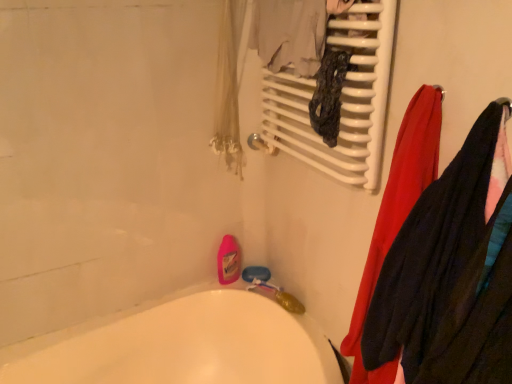
Question: Does white glossy bathtub at lower left have a lesser height compared to white glossy radiator at upper center?

Choices:
 (A) yes
 (B) no

Answer: (B)

Question: From the image's perspective, does white glossy bathtub at lower left appear lower than white glossy radiator at upper center?

Choices:
 (A) yes
 (B) no

Answer: (A)

Question: Would you consider white glossy bathtub at lower left to be distant from white glossy radiator at upper center?

Choices:
 (A) no
 (B) yes

Answer: (A)

Question: From the image's perspective, is white glossy bathtub at lower left on top of white glossy radiator at upper center?

Choices:
 (A) yes
 (B) no

Answer: (B)

Question: From a real-world perspective, is white glossy bathtub at lower left on top of white glossy radiator at upper center?

Choices:
 (A) no
 (B) yes

Answer: (A)

Question: Is point (504, 119) positioned closer to the camera than point (365, 117)?

Choices:
 (A) closer
 (B) farther

Answer: (A)

Question: Based on their sizes in the image, would you say velvet-like black sweater at right, placed as the second clothing when sorted from left to right, is bigger or smaller than white glossy radiator at upper center?

Choices:
 (A) small
 (B) big

Answer: (B)

Question: Considering the positions of velvet-like black sweater at right, which is the 1th clothing in right-to-left order, and white glossy radiator at upper center in the image, is velvet-like black sweater at right, which is the 1th clothing in right-to-left order, wider or thinner than white glossy radiator at upper center?

Choices:
 (A) thin
 (B) wide

Answer: (B)

Question: Is velvet-like black sweater at right, which is the 1th clothing in right-to-left order, situated inside white glossy radiator at upper center or outside?

Choices:
 (A) inside
 (B) outside

Answer: (B)

Question: Is point (372, 48) closer or farther from the camera than point (62, 370)?

Choices:
 (A) closer
 (B) farther

Answer: (A)

Question: Looking at their shapes, would you say white glossy radiator at upper center is wider or thinner than white glossy bathtub at lower left?

Choices:
 (A) wide
 (B) thin

Answer: (B)

Question: Is white glossy radiator at upper center in front of or behind white glossy bathtub at lower left in the image?

Choices:
 (A) behind
 (B) front

Answer: (A)

Question: From a real-world perspective, relative to white glossy bathtub at lower left, is white glossy radiator at upper center vertically above or below?

Choices:
 (A) below
 (B) above

Answer: (B)

Question: Choose the correct answer: Is white glossy radiator at upper center inside red fabric towel at right, the 2th clothing when ordered from right to left, or outside it?

Choices:
 (A) outside
 (B) inside

Answer: (A)

Question: In the image, is white glossy radiator at upper center positioned in front of or behind red fabric towel at right, the 2th clothing when ordered from right to left?

Choices:
 (A) front
 (B) behind

Answer: (B)